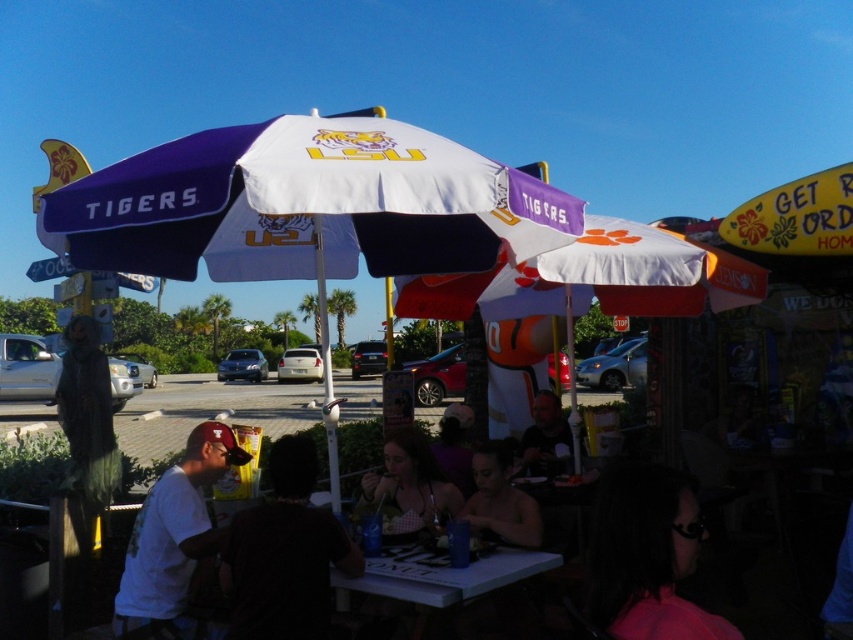
Question: Is white matte t-shirt at lower left above white plastic table at center?

Choices:
 (A) yes
 (B) no

Answer: (A)

Question: Estimate the real-world distances between objects in this image. Which object is farther from the white plastic table at center?

Choices:
 (A) white matte umbrella at center
 (B) dark fabric shirt at center

Answer: (A)

Question: Which point is closer to the camera?

Choices:
 (A) (199, 500)
 (B) (390, 496)
 (C) (552, 417)
 (D) (399, 300)

Answer: (A)

Question: Is matte black shirt at center to the left of white plastic pole at center from the viewer's perspective?

Choices:
 (A) no
 (B) yes

Answer: (A)

Question: Which object is positioned closest to the white plastic table at center?

Choices:
 (A) white matte t-shirt at lower left
 (B) smooth skin face at center

Answer: (B)

Question: Can you confirm if dark fabric shirt at center is positioned to the left of white plastic pole at center?

Choices:
 (A) no
 (B) yes

Answer: (A)